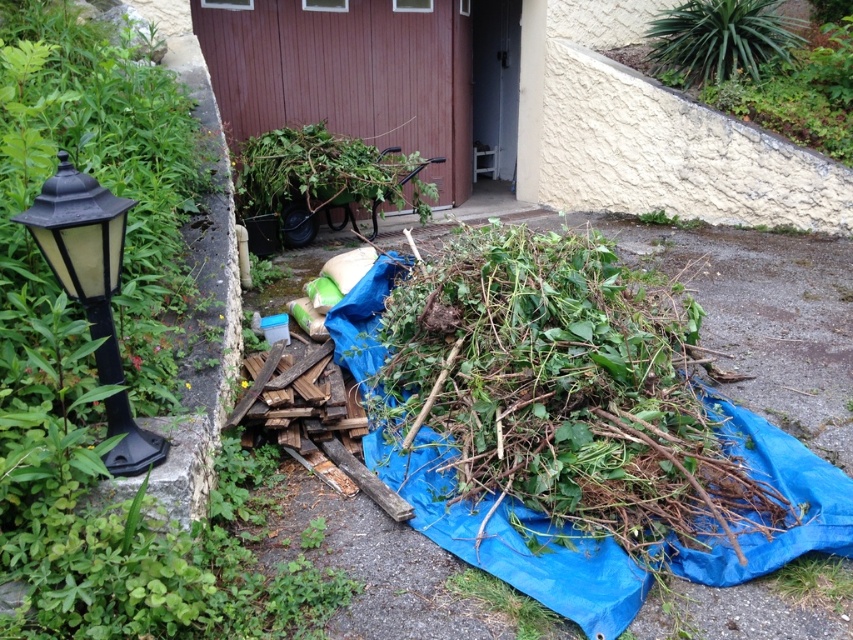
Who is positioned more to the right, black plastic lamp post at left or green leafy plant at center?

From the viewer's perspective, black plastic lamp post at left appears more on the right side.

Which is more to the left, black plastic lamp post at left or green leafy plant at center?

From the viewer's perspective, green leafy plant at center appears more on the left side.

Locate an element on the screen. The height and width of the screenshot is (640, 853). black plastic lamp post at left is located at coordinates (83, 250).

At what (x,y) coordinates should I click in order to perform the action: click on black plastic lamp post at left. Please return your answer as a coordinate pair (x, y). The height and width of the screenshot is (640, 853). Looking at the image, I should click on (83, 250).

Does brown wooden wheelbarrow at center come behind black plastic lamp post at left?

That is True.

Between brown wooden wheelbarrow at center and black plastic lamp post at left, which one has more height?

brown wooden wheelbarrow at center is taller.

The image size is (853, 640). What are the coordinates of `brown wooden wheelbarrow at center` in the screenshot? It's located at (647, 132).

Which of these two, brown wooden wheelbarrow at center or green leafy plant at upper right, stands taller?

With more height is brown wooden wheelbarrow at center.

Can you confirm if brown wooden wheelbarrow at center is taller than green leafy plant at upper right?

Correct, brown wooden wheelbarrow at center is much taller as green leafy plant at upper right.

Is point (813, 186) closer to viewer compared to point (723, 44)?

That is True.

You are a GUI agent. You are given a task and a screenshot of the screen. Output one action in this format:
    pyautogui.click(x=<x>, y=<y>)
    Task: Click on the brown wooden wheelbarrow at center
    Image resolution: width=853 pixels, height=640 pixels.
    Given the screenshot: What is the action you would take?
    pyautogui.click(x=647, y=132)